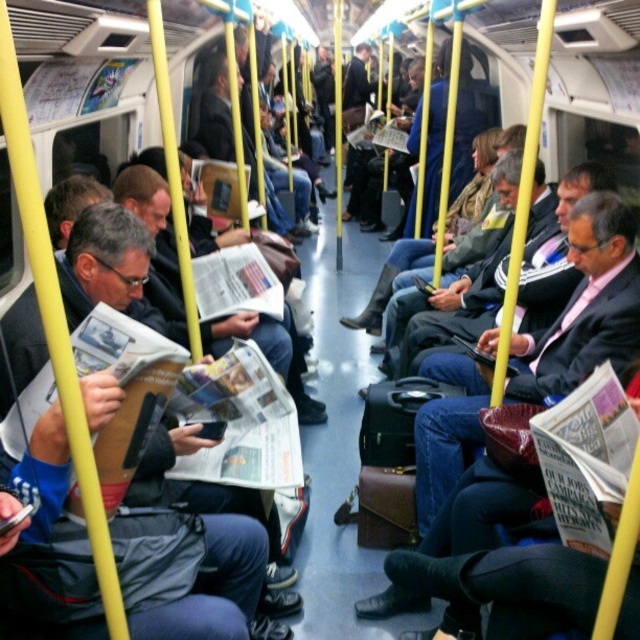
Question: Which point is farther to the camera?

Choices:
 (A) (458, 330)
 (B) (145, 218)
 (C) (129, 602)
 (D) (548, 374)

Answer: (A)

Question: In this image, where is matte black jacket at left located relative to matte black suit at center?

Choices:
 (A) above
 (B) below

Answer: (B)

Question: Which of these objects is positioned closest to the matte black suit at center?

Choices:
 (A) matte black newspaper at center
 (B) matte black jacket at left

Answer: (A)

Question: Considering the relative positions of matte black suit at center and dark blue suit at center in the image provided, where is matte black suit at center located with respect to dark blue suit at center?

Choices:
 (A) above
 (B) below

Answer: (B)

Question: Can you confirm if matte black jacket at left is positioned below dark blue suit at center?

Choices:
 (A) yes
 (B) no

Answer: (A)

Question: Which of the following is the farthest from the observer?

Choices:
 (A) dark blue suit at center
 (B) matte black suit at center
 (C) matte black newspaper at center
 (D) matte black jacket at left

Answer: (A)